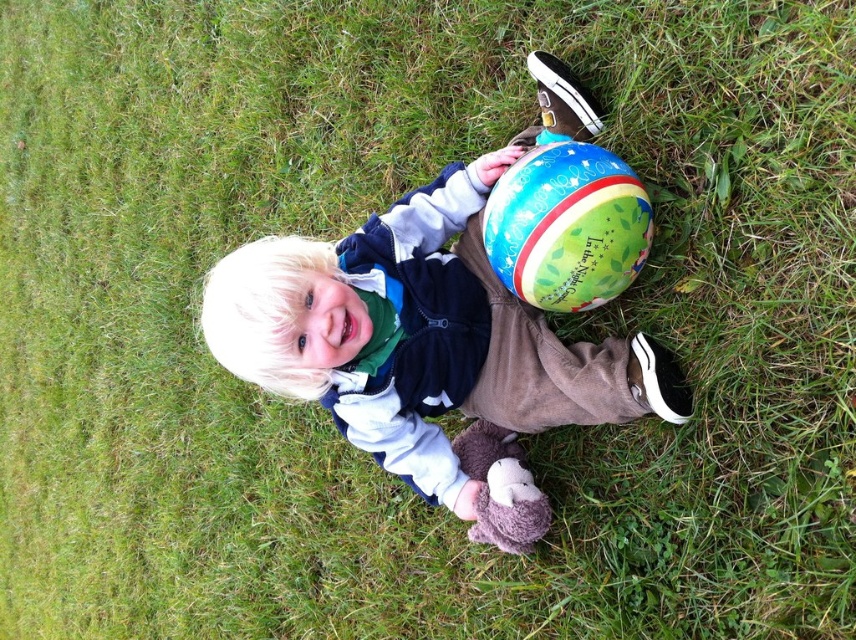
You are a child trying to reach both the matte blue ball at center and the multicolored fabric beach ball at center. Which one is closer to your left hand?

The matte blue ball at center is to the left of the multicolored fabric beach ball at center, so it is closer to your left hand.

You are a photographer trying to capture a photo of the child holding both the matte blue ball at center and the multicolored fabric beach ball at center. Based on their positions, which ball should you focus on first to ensure both are in the frame?

The matte blue ball at center is located below the multicolored fabric beach ball at center, so you should focus on the multicolored fabric beach ball at center first to ensure both are in the frame.

You are a child holding both the matte blue ball at center and the multicolored fabric beach ball at center. You want to throw them both as far as you can. Which ball will land farther away from you?

The multicolored fabric beach ball at center will land farther away because it is lighter and larger than the matte blue ball at center, which is smaller and denser. However, according to the description, the matte blue ball at center is 12.64 inches away from the multicolored fabric beach ball at center, but this distance does not affect their throwing distance.